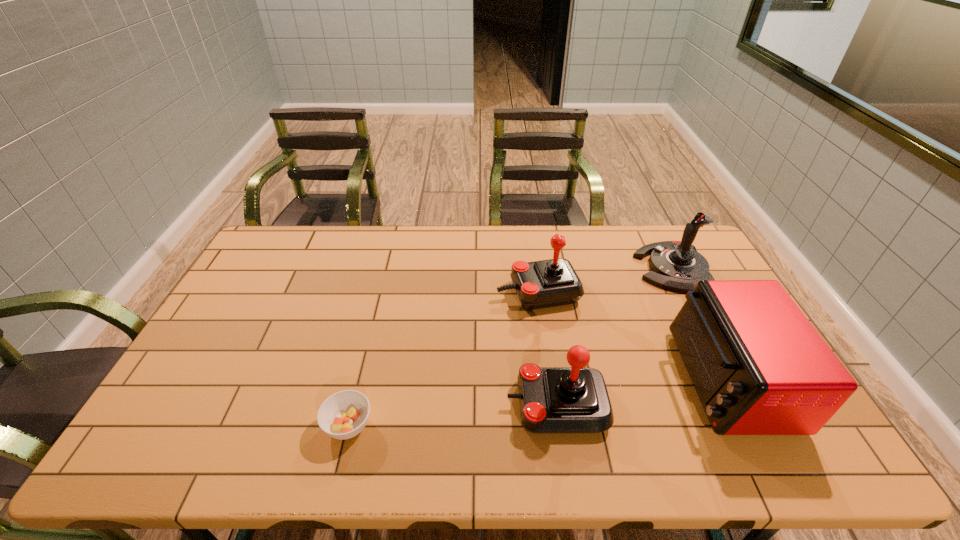
At what (x,y) coordinates should I click in order to perform the action: click on the rightmost joystick. Please return your answer as a coordinate pair (x, y). Looking at the image, I should click on (676, 265).

This screenshot has height=540, width=960. What are the coordinates of `the nearest joystick` in the screenshot? It's located at (575, 399).

I want to click on toaster oven, so click(x=759, y=367).

This screenshot has height=540, width=960. I want to click on the shortest object, so click(x=343, y=415).

Image resolution: width=960 pixels, height=540 pixels. Find the location of `the leftmost object`. the leftmost object is located at coordinates (343, 415).

Find the location of a particular element. vacant space located on the handle side of the rightmost joystick is located at coordinates (551, 268).

This screenshot has width=960, height=540. Find the location of `vacant space located 0.110m on the handle side of the rightmost joystick`. vacant space located 0.110m on the handle side of the rightmost joystick is located at coordinates 606,268.

Where is `vacant area situated on the handle side of the rightmost joystick`? vacant area situated on the handle side of the rightmost joystick is located at coordinates coord(545,268).

This screenshot has height=540, width=960. In order to click on free space located on the base of the nearest joystick in this screenshot , I will do `click(480, 404)`.

The width and height of the screenshot is (960, 540). What are the coordinates of `free location located on the base of the nearest joystick` in the screenshot? It's located at (371, 404).